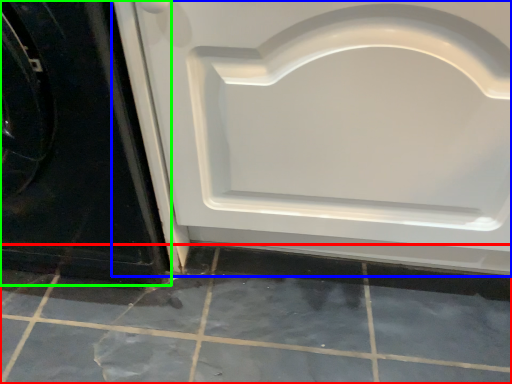
Question: Estimate the real-world distances between objects in this image. Which object is farther from ceramic tile (highlighted by a red box), door (highlighted by a blue box) or door (highlighted by a green box)?

Choices:
 (A) door
 (B) door

Answer: (B)